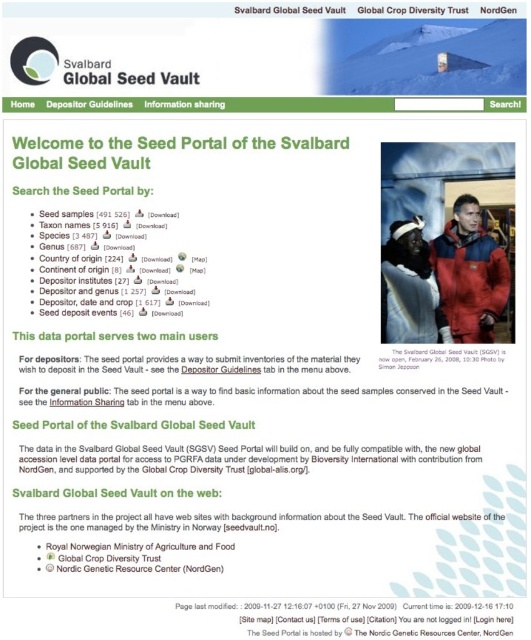
Does matte red jacket at center have a lesser height compared to matte black sign at upper center?

No, matte red jacket at center is not shorter than matte black sign at upper center.

The height and width of the screenshot is (640, 531). Identify the location of matte red jacket at center. (469, 275).

Does point (449, 320) come farther from viewer compared to point (494, 349)?

Yes.

Where is `matte red jacket at center`? Image resolution: width=531 pixels, height=640 pixels. matte red jacket at center is located at coordinates (469, 275).

Who is positioned more to the left, matte plastic computer screen at upper right or white paper at upper center?

white paper at upper center

Is matte plastic computer screen at upper right below white paper at upper center?

Incorrect, matte plastic computer screen at upper right is not positioned below white paper at upper center.

Is point (388, 163) farther from viewer compared to point (100, 268)?

Yes, point (388, 163) is behind point (100, 268).

Find the location of `matte plastic computer screen at upper right`. matte plastic computer screen at upper right is located at coordinates (452, 221).

Is matte blue jacket at center closer to camera compared to matte black sign at upper center?

That is False.

Who is lower down, matte blue jacket at center or matte black sign at upper center?

matte black sign at upper center is below.

This screenshot has height=640, width=531. Identify the location of matte blue jacket at center. (409, 289).

Find the location of a particular element. This screenshot has height=640, width=531. matte blue jacket at center is located at coordinates (409, 289).